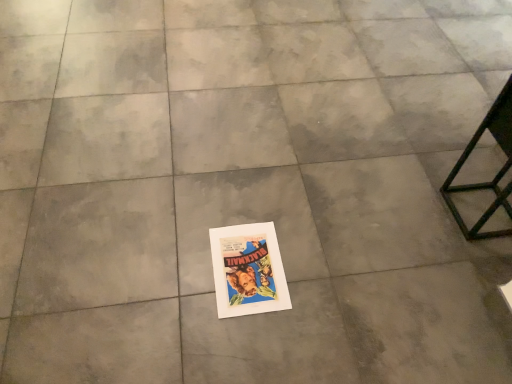
Where is `vacant space that is to the left of vibrant paper poster at center`? vacant space that is to the left of vibrant paper poster at center is located at coordinates [175, 266].